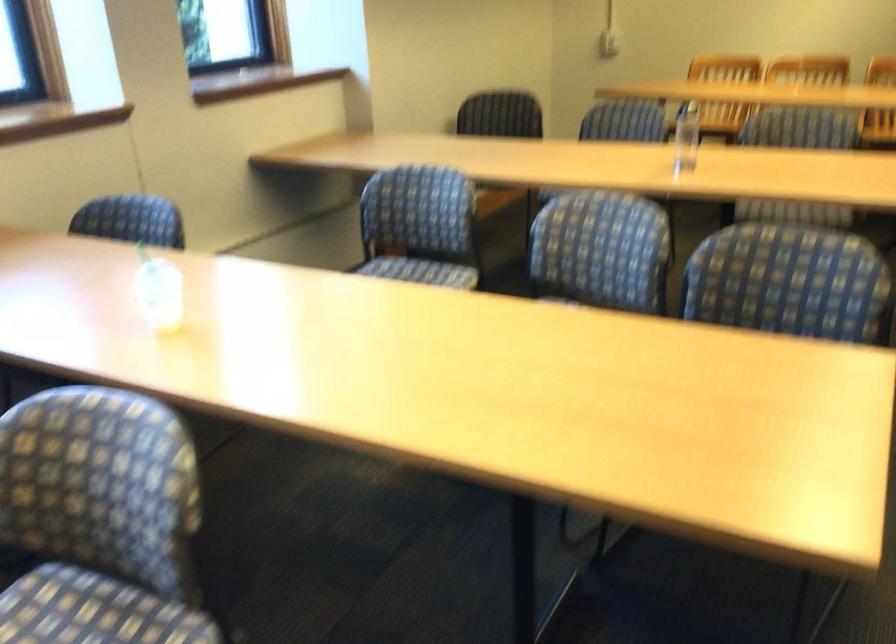
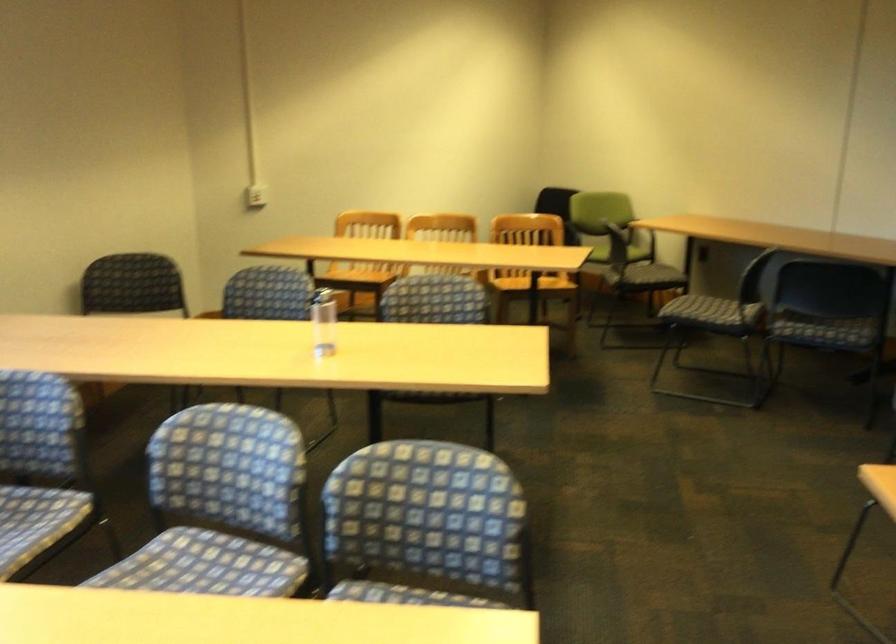
From the picture: Which direction would the cameraman need to move to produce the second image?

The movement direction of the cameraman is right, forward.